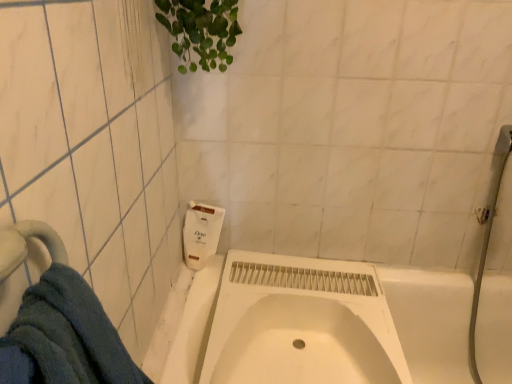
Question: From a real-world perspective, is white matte sink at center below white matte bathtub at center?

Choices:
 (A) yes
 (B) no

Answer: (B)

Question: Does white matte sink at center turn towards white matte bathtub at center?

Choices:
 (A) yes
 (B) no

Answer: (A)

Question: Is white matte sink at center positioned with its back to white matte bathtub at center?

Choices:
 (A) no
 (B) yes

Answer: (B)

Question: From the image's perspective, is white matte sink at center located beneath white matte bathtub at center?

Choices:
 (A) no
 (B) yes

Answer: (A)

Question: Would you say white matte sink at center contains white matte bathtub at center?

Choices:
 (A) yes
 (B) no

Answer: (B)

Question: In terms of size, does blue cotton towel at lower left appear bigger or smaller than white matte soap dispenser at upper center?

Choices:
 (A) big
 (B) small

Answer: (A)

Question: Would you say blue cotton towel at lower left is inside or outside white matte soap dispenser at upper center?

Choices:
 (A) outside
 (B) inside

Answer: (A)

Question: Is point (89, 296) closer or farther from the camera than point (205, 243)?

Choices:
 (A) closer
 (B) farther

Answer: (A)

Question: From the image's perspective, is blue cotton towel at lower left positioned above or below white matte soap dispenser at upper center?

Choices:
 (A) below
 (B) above

Answer: (A)

Question: Does point (35, 307) appear closer or farther from the camera than point (236, 349)?

Choices:
 (A) farther
 (B) closer

Answer: (B)

Question: From a real-world perspective, is blue cotton towel at lower left physically located above or below white matte sink at center?

Choices:
 (A) above
 (B) below

Answer: (A)

Question: From the image's perspective, is blue cotton towel at lower left positioned above or below white matte sink at center?

Choices:
 (A) above
 (B) below

Answer: (A)

Question: Based on their positions, is blue cotton towel at lower left located to the left or right of white matte sink at center?

Choices:
 (A) left
 (B) right

Answer: (A)

Question: Considering the positions of white matte sink at center and blue cotton towel at lower left in the image, is white matte sink at center wider or thinner than blue cotton towel at lower left?

Choices:
 (A) thin
 (B) wide

Answer: (B)

Question: In terms of size, does white matte sink at center appear bigger or smaller than blue cotton towel at lower left?

Choices:
 (A) small
 (B) big

Answer: (B)